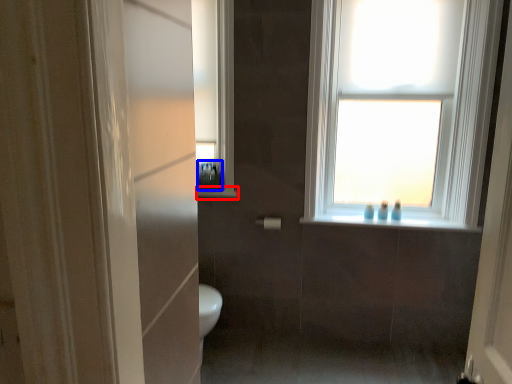
Question: Which object appears closest to the camera in this image, window sill (highlighted by a red box) or toiletry (highlighted by a blue box)?

Choices:
 (A) window sill
 (B) toiletry

Answer: (B)